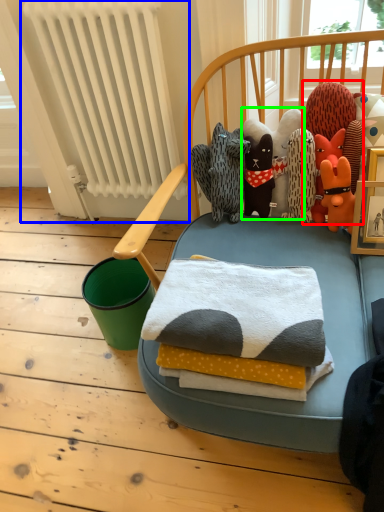
Question: Which object is the farthest from toy (highlighted by a red box)? Choose among these: radiator (highlighted by a blue box) or toy (highlighted by a green box).

Choices:
 (A) radiator
 (B) toy

Answer: (A)